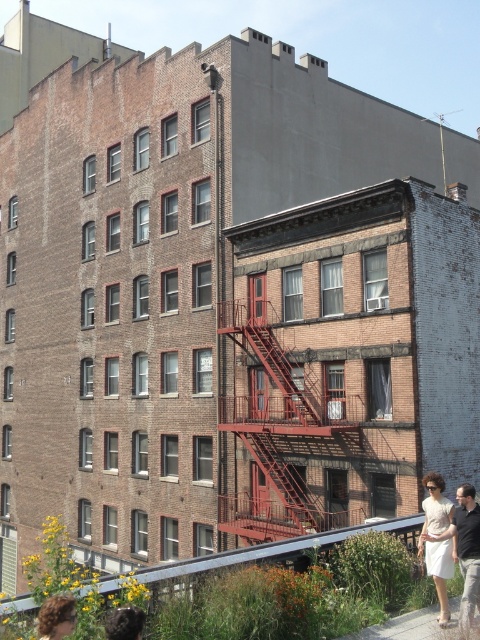
Is white cotton dress at lower right above blonde hair at lower left?

Yes.

Is point (467, 605) in front of point (57, 609)?

No, (467, 605) is behind (57, 609).

This screenshot has height=640, width=480. I want to click on white cotton dress at lower right, so click(x=465, y=548).

Between point (305, 422) and point (474, 604), which one is positioned behind?

Point (305, 422)

Is rusty metal fire escape at center below white cotton dress at lower right?

Yes.

Who is more distant from viewer, (310,387) or (462,516)?

The point (310,387) is more distant.

Find the location of a particular element. This screenshot has width=480, height=640. rusty metal fire escape at center is located at coordinates (278, 433).

Is rusty metal fire escape at center positioned at the back of blonde hair at lower left?

Yes, it is behind blonde hair at lower left.

Where is `rusty metal fire escape at center`? This screenshot has width=480, height=640. rusty metal fire escape at center is located at coordinates (278, 433).